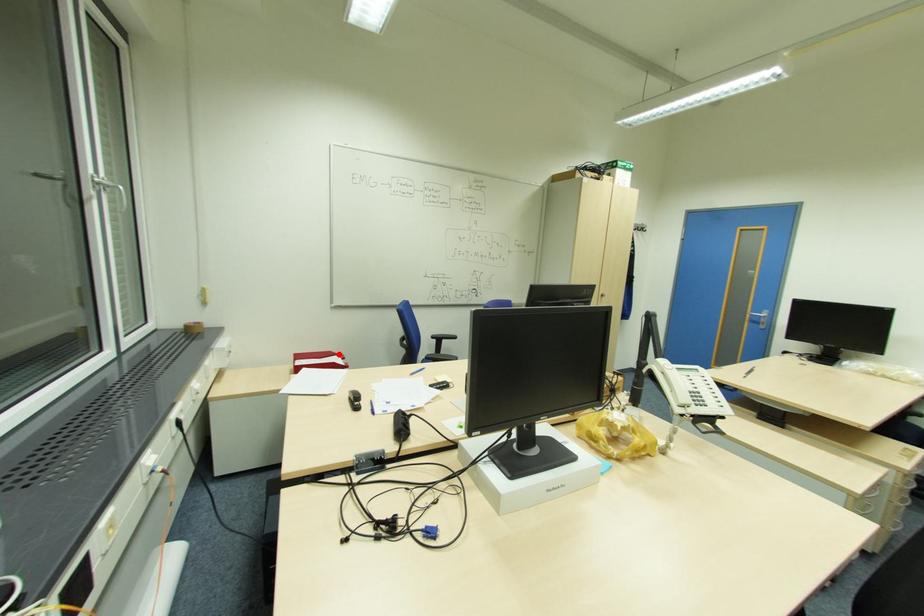
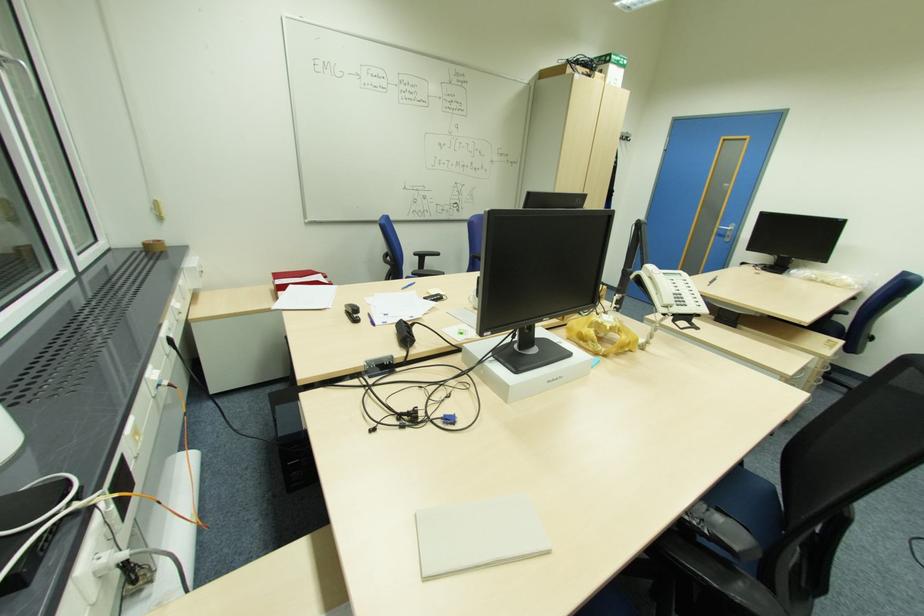
In the second image, find the point that corresponds to the highlighted location in the first image.

(320, 273)